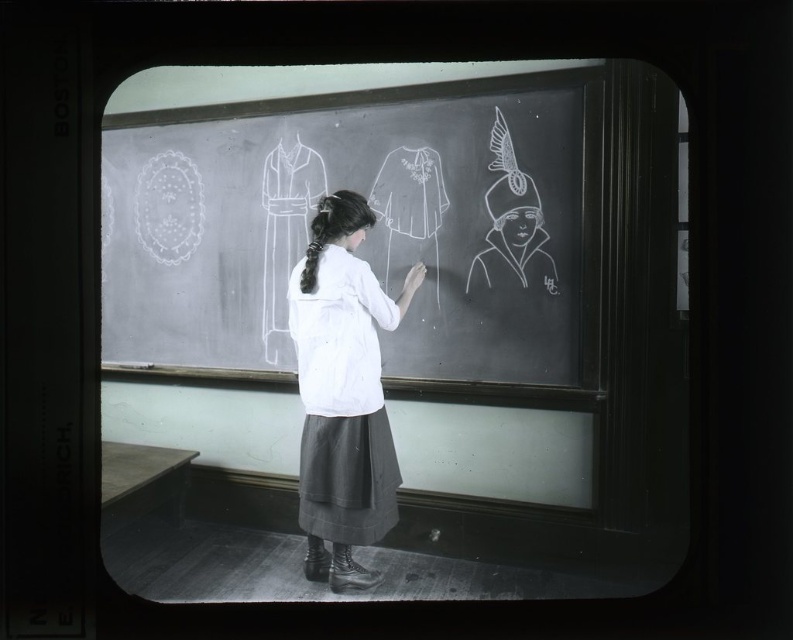
You are a student in the classroom observing the teacher. The teacher is wearing a white cotton blouse at center and has drawn a white chalk dress at center on the blackboard. Which clothing item is taller?

The white cotton blouse at center is much taller than the white chalk dress at center.

In the vintage classroom scene, there is a woman wearing a white cotton blouse at center and standing at a blackboard with three chalk drawings. The coordinates point to an object in the image. Can you identify what object is located at the coordinates point (343, 392)?

The coordinates point (343, 392) indicate the location of the white cotton blouse at center.

Where is the white cotton blouse at center located in the image?

The white cotton blouse at center is located at point [343,392].